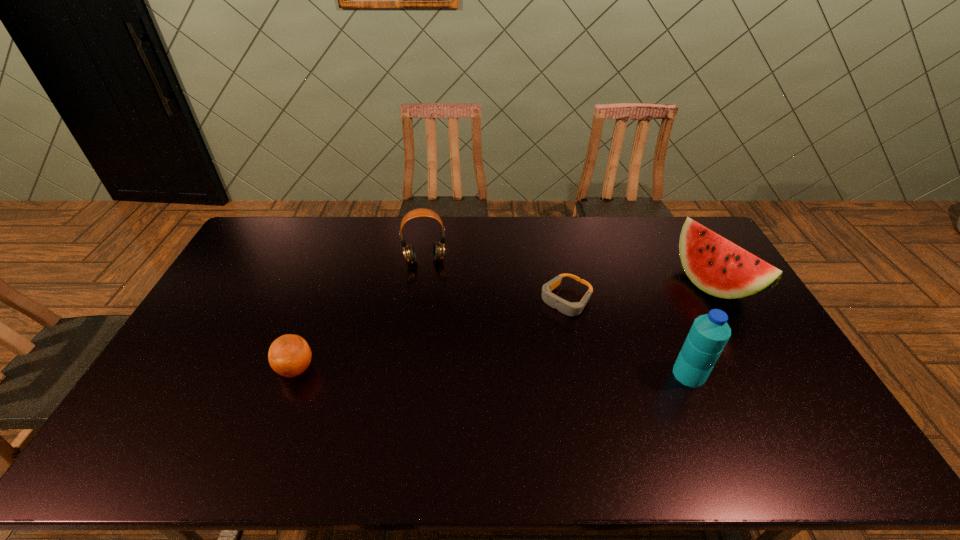
This screenshot has width=960, height=540. I want to click on object present at the right edge, so [717, 266].

This screenshot has height=540, width=960. Find the location of `object that is at the far right corner`. object that is at the far right corner is located at coordinates (717, 266).

At what (x,y) coordinates should I click in order to perform the action: click on vacant space at the far edge of the desktop. Please return your answer as a coordinate pair (x, y). Image resolution: width=960 pixels, height=540 pixels. Looking at the image, I should click on (475, 217).

Where is `vacant space at the near edge of the desktop`? vacant space at the near edge of the desktop is located at coordinates (516, 409).

The width and height of the screenshot is (960, 540). In the image, there is a desktop. What are the coordinates of `vacant space at the left edge` in the screenshot? It's located at (167, 376).

This screenshot has height=540, width=960. In the image, there is a desktop. Find the location of `vacant space at the right edge`. vacant space at the right edge is located at coordinates (758, 380).

The height and width of the screenshot is (540, 960). In the image, there is a desktop. Find the location of `free space at the far right corner`. free space at the far right corner is located at coordinates (670, 237).

The height and width of the screenshot is (540, 960). I want to click on free point between the watermelon and the headset, so click(x=568, y=272).

Where is `free space between the headset and the watermelon`? Image resolution: width=960 pixels, height=540 pixels. free space between the headset and the watermelon is located at coordinates (568, 272).

Locate an element on the screen. vacant space in between the headset and the leftmost object is located at coordinates (361, 315).